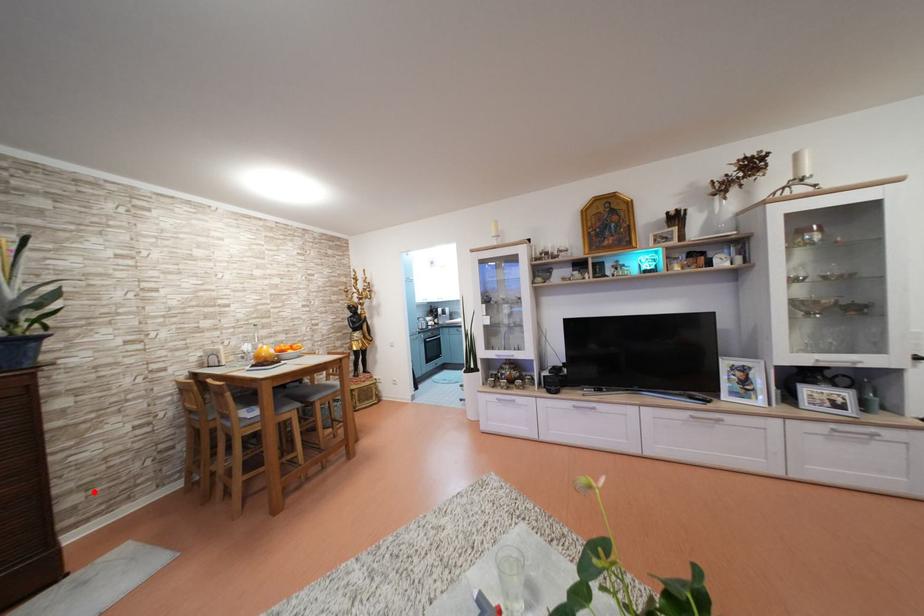
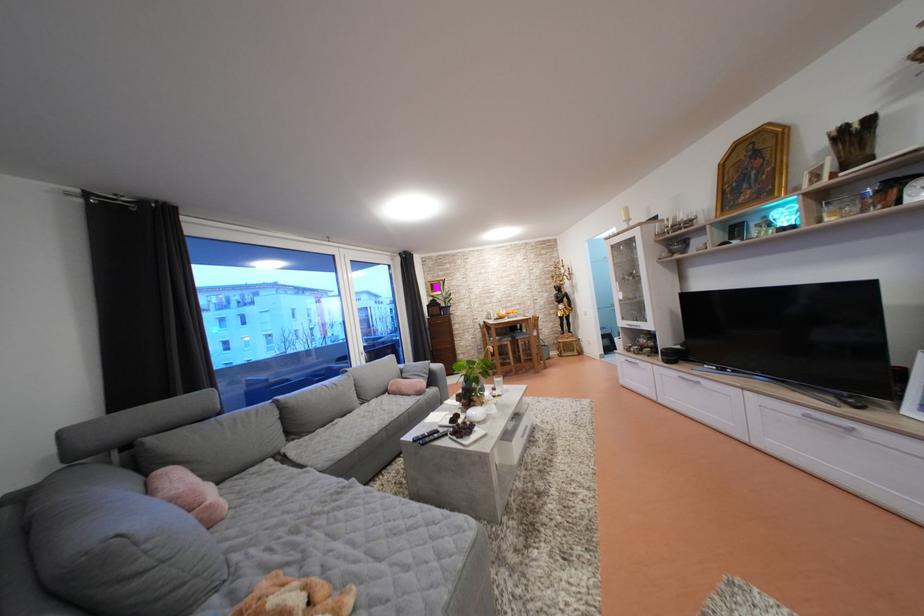
Locate, in the second image, the point that corresponds to the highlighted location in the first image.

(470, 359)